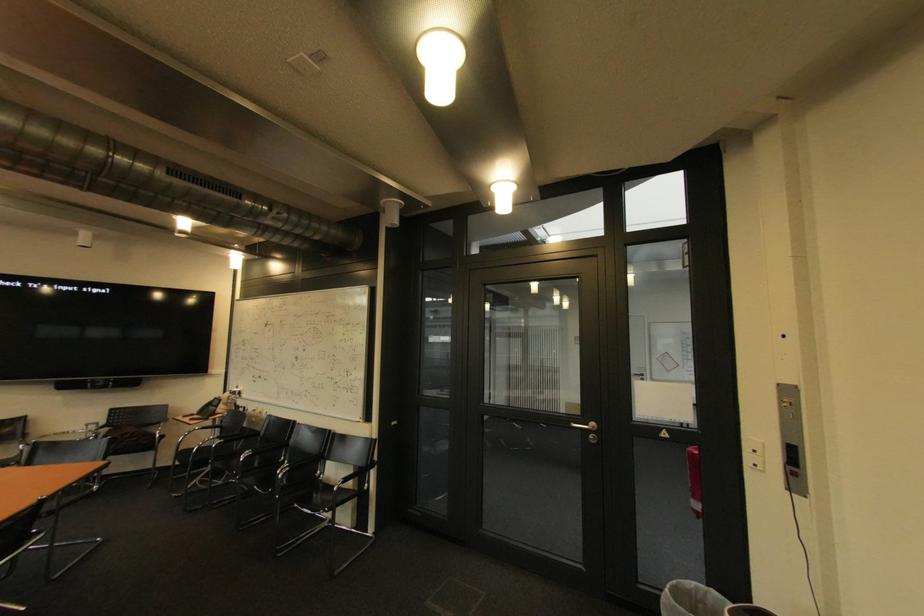
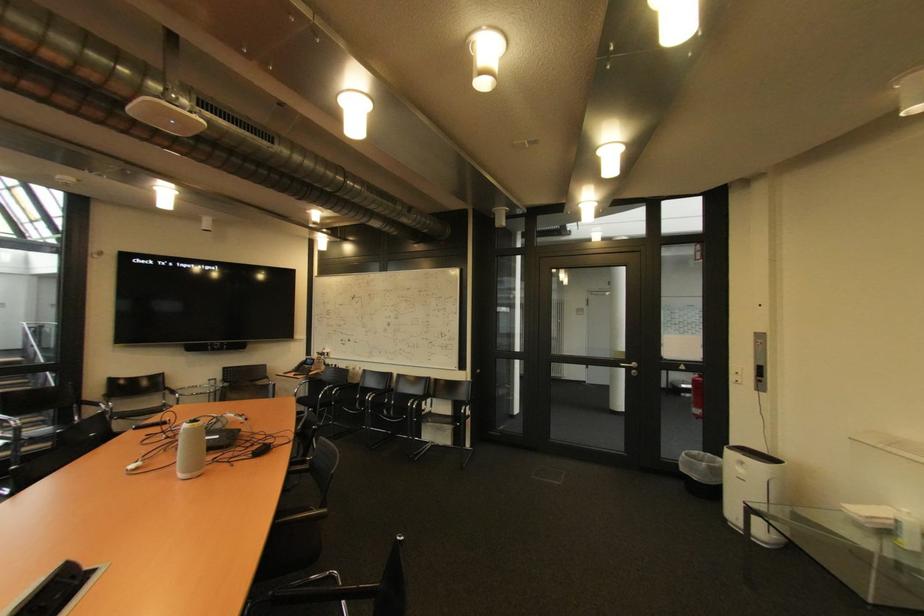
The point at (698, 501) is marked in the first image. Where is the corresponding point in the second image?

(699, 411)